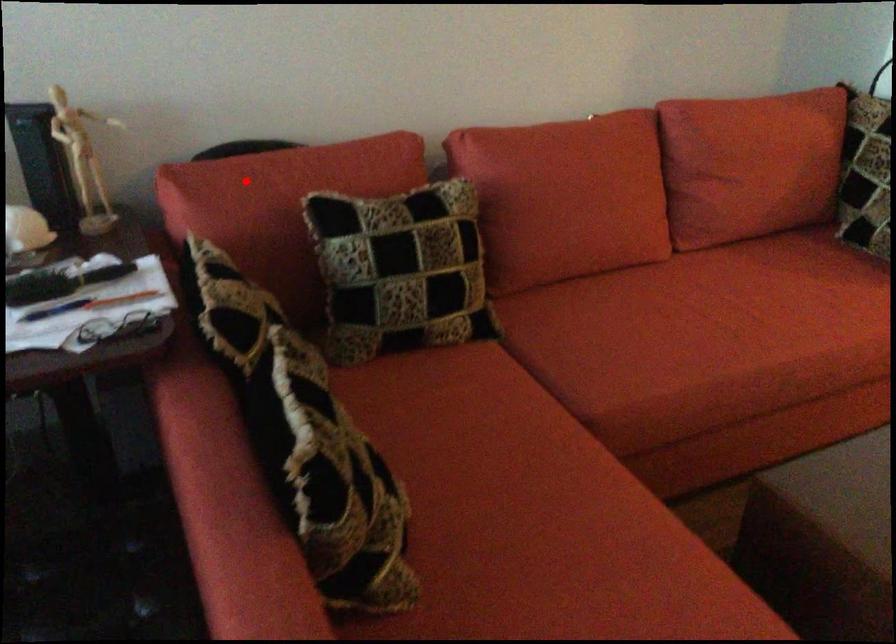
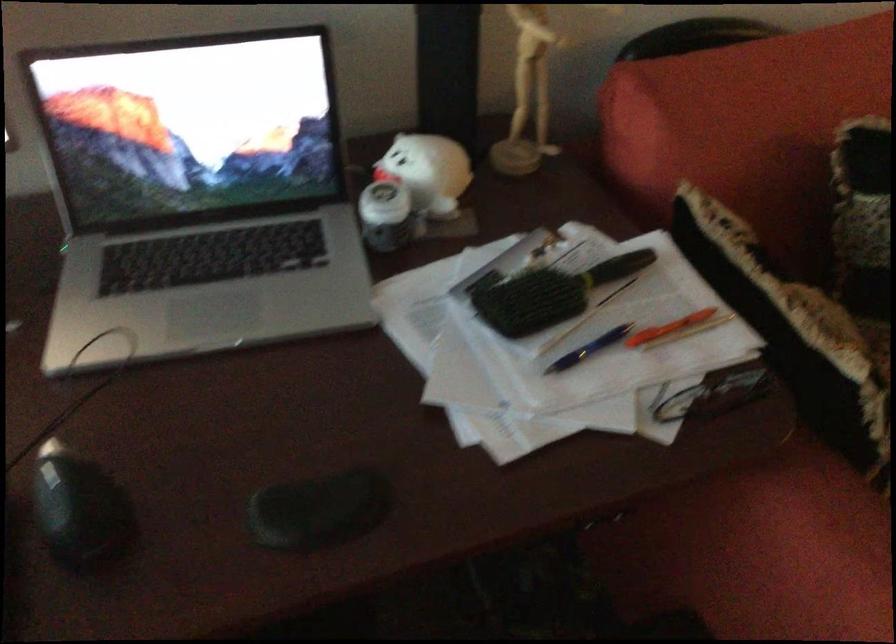
Question: I am providing you with two images of the same scene from different viewpoints. In image1, a red point is highlighted. Considering the same 3D point in image2, which of the following is correct?

Choices:
 (A) It is closer
 (B) It is farther

Answer: (A)